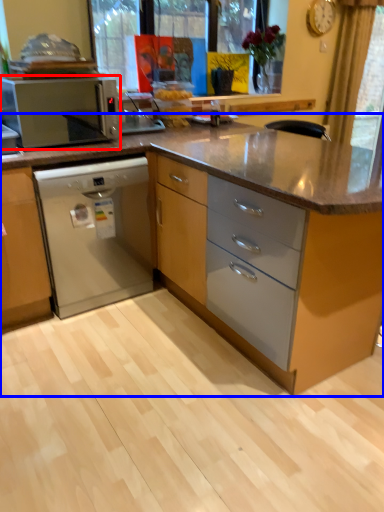
Question: Which object appears closest to the camera in this image, kitchen appliance (highlighted by a red box) or cabinetry (highlighted by a blue box)?

Choices:
 (A) kitchen appliance
 (B) cabinetry

Answer: (B)